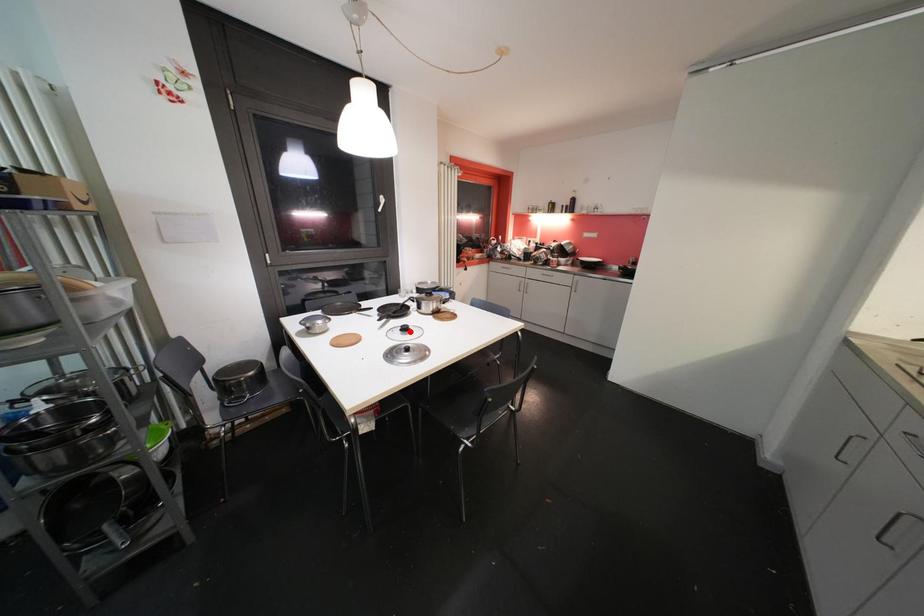
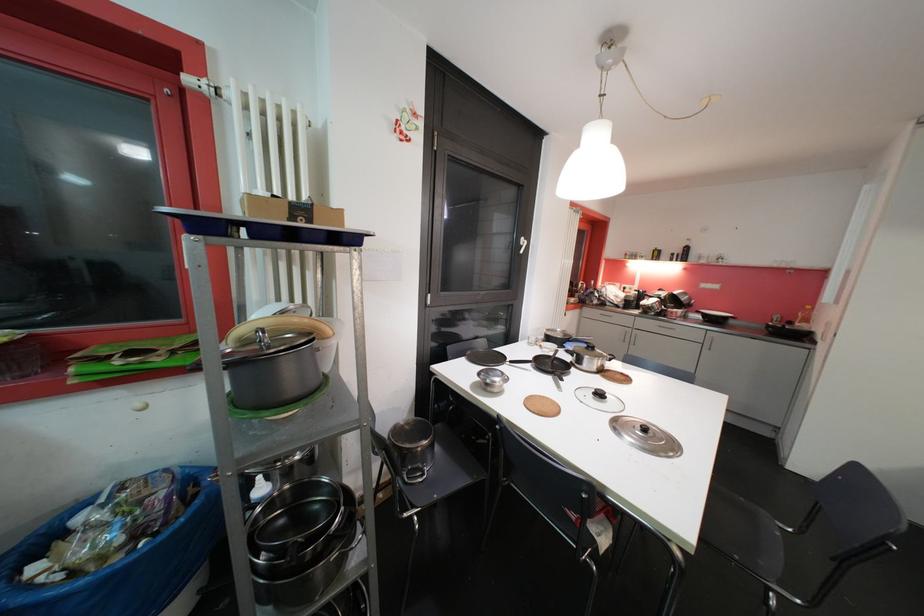
Locate, in the second image, the point that corresponds to the highlighted location in the first image.

(604, 397)